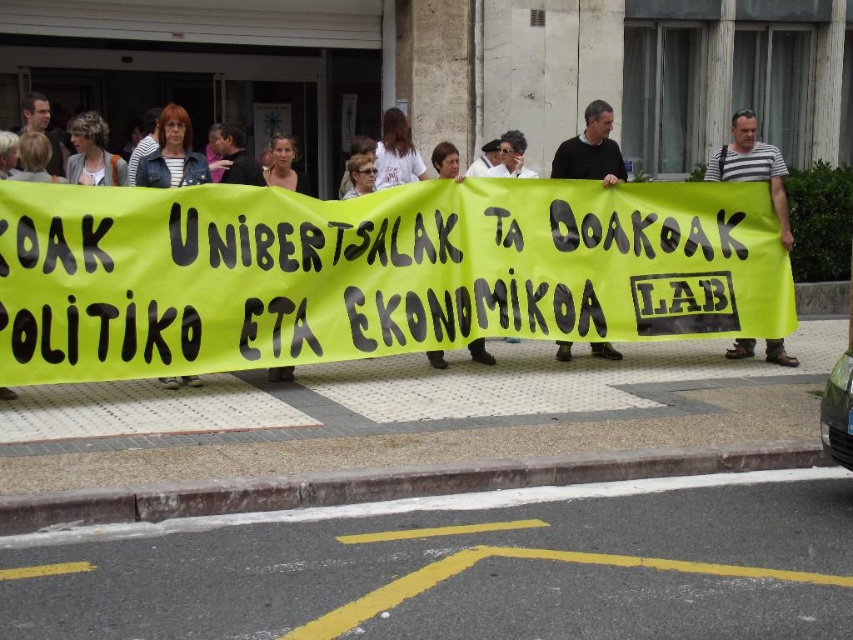
Which is above, striped fabric shirt at center or black sweater at center?

black sweater at center is higher up.

Does point (737, 134) come closer to viewer compared to point (593, 176)?

Yes.

Who is more forward, (793, 362) or (618, 168)?

Point (618, 168) is more forward.

Identify the location of striped fabric shirt at center. The width and height of the screenshot is (853, 640). (752, 166).

Which is more to the right, yellow fabric banner at center or striped fabric jacket at center?

yellow fabric banner at center

Identify the location of yellow fabric banner at center. This screenshot has height=640, width=853. (370, 272).

You are a GUI agent. You are given a task and a screenshot of the screen. Output one action in this format:
    pyautogui.click(x=<x>, y=<y>)
    Task: Click on the yellow fabric banner at center
    The image size is (853, 640).
    Given the screenshot: What is the action you would take?
    pyautogui.click(x=370, y=272)

Is yellow fabric banner at center positioned in front of striped fabric shirt at center?

That is False.

Can you confirm if yellow fabric banner at center is positioned to the left of striped fabric shirt at center?

Indeed, yellow fabric banner at center is positioned on the left side of striped fabric shirt at center.

Is point (173, 252) more distant than point (764, 173)?

No, it is in front of (764, 173).

This screenshot has height=640, width=853. In order to click on yellow fabric banner at center in this screenshot , I will do `click(370, 272)`.